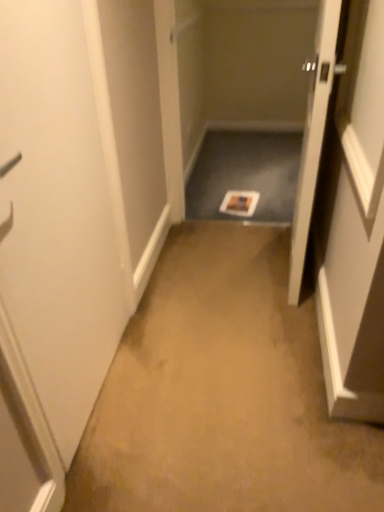
What is the approximate width of matte gray tray at center?

It is 5.29 feet.

This screenshot has height=512, width=384. What do you see at coordinates (57, 213) in the screenshot?
I see `white matte door at left, the first door in the left-to-right sequence` at bounding box center [57, 213].

Locate an element on the screen. The height and width of the screenshot is (512, 384). wooden door at right, the second door from the left is located at coordinates 313,138.

Considering the positions of point (3, 112) and point (249, 144), is point (3, 112) closer or farther from the camera than point (249, 144)?

Point (3, 112) is closer to the camera than point (249, 144).

Is white matte door at left, the second door positioned from the right, wider or thinner than matte gray tray at center?

Considering their sizes, white matte door at left, the second door positioned from the right, looks slimmer than matte gray tray at center.

Consider the image. Can you confirm if white matte door at left, the second door positioned from the right, is shorter than matte gray tray at center?

No.

Is wooden door at right, acting as the 1th door starting from the right, in contact with white matte door at left, the first door in the left-to-right sequence?

wooden door at right, acting as the 1th door starting from the right, is not next to white matte door at left, the first door in the left-to-right sequence, and they're not touching.

Where is `door on the right of white matte door at left, the second door positioned from the right`? The height and width of the screenshot is (512, 384). door on the right of white matte door at left, the second door positioned from the right is located at coordinates (313, 138).

Can you confirm if wooden door at right, acting as the 1th door starting from the right, is smaller than white matte door at left, the first door in the left-to-right sequence?

Incorrect, wooden door at right, acting as the 1th door starting from the right, is not smaller in size than white matte door at left, the first door in the left-to-right sequence.

Is wooden door at right, the second door from the left, located outside matte gray tray at center?

Yes, wooden door at right, the second door from the left, is not within matte gray tray at center.

From the image's perspective, which is above, wooden door at right, acting as the 1th door starting from the right, or matte gray tray at center?

From the image's view, matte gray tray at center is above.

Which of these two, wooden door at right, the second door from the left, or matte gray tray at center, is bigger?

wooden door at right, the second door from the left, is bigger.

Is point (272, 175) closer or farther from the camera than point (305, 143)?

Point (272, 175) is farther from the camera than point (305, 143).

Is matte gray tray at center surrounding wooden door at right, the second door from the left?

No.

Where is `corridor above the wooden door at right, the second door from the left (from the image's perspective)`? Image resolution: width=384 pixels, height=512 pixels. corridor above the wooden door at right, the second door from the left (from the image's perspective) is located at coordinates (245, 174).

At what (x,y) coordinates should I click in order to perform the action: click on the 2nd door in front of the matte gray tray at center, starting your count from the anchor. Please return your answer as a coordinate pair (x, y). The width and height of the screenshot is (384, 512). Looking at the image, I should click on (57, 213).

Is point (218, 190) positioned in front of point (32, 104)?

No.

From a real-world perspective, is white matte door at left, the first door in the left-to-right sequence, on wooden door at right, the second door from the left?

Indeed, from a real-world perspective, white matte door at left, the first door in the left-to-right sequence, stands above wooden door at right, the second door from the left.

Is white matte door at left, the second door positioned from the right, in front of or behind wooden door at right, acting as the 1th door starting from the right, in the image?

white matte door at left, the second door positioned from the right, is in front of wooden door at right, acting as the 1th door starting from the right.

Considering the relative sizes of white matte door at left, the second door positioned from the right, and wooden door at right, the second door from the left, in the image provided, is white matte door at left, the second door positioned from the right, smaller than wooden door at right, the second door from the left,?

Correct, white matte door at left, the second door positioned from the right, occupies less space than wooden door at right, the second door from the left.

Locate an element on the screen. This screenshot has height=512, width=384. the 2nd door directly above the matte gray tray at center (from a real-world perspective) is located at coordinates (57, 213).

Identify the location of door in front of the wooden door at right, the second door from the left. The width and height of the screenshot is (384, 512). (57, 213).

In the scene shown: Based on their spatial positions, is matte gray tray at center or wooden door at right, acting as the 1th door starting from the right, closer to white matte door at left, the first door in the left-to-right sequence?

wooden door at right, acting as the 1th door starting from the right, is closer to white matte door at left, the first door in the left-to-right sequence.

Based on their spatial positions, is wooden door at right, the second door from the left, or white matte door at left, the second door positioned from the right, further from matte gray tray at center?

white matte door at left, the second door positioned from the right, is further to matte gray tray at center.

In the scene shown: Considering their positions, is wooden door at right, the second door from the left, positioned further to white matte door at left, the first door in the left-to-right sequence, than matte gray tray at center?

The object further to white matte door at left, the first door in the left-to-right sequence, is matte gray tray at center.

Considering their positions, is white matte door at left, the second door positioned from the right, positioned closer to wooden door at right, the second door from the left, than matte gray tray at center?

white matte door at left, the second door positioned from the right, lies closer to wooden door at right, the second door from the left, than the other object.

When comparing their distances from wooden door at right, acting as the 1th door starting from the right, does matte gray tray at center or white matte door at left, the first door in the left-to-right sequence, seem further?

The object further to wooden door at right, acting as the 1th door starting from the right, is matte gray tray at center.

Estimate the real-world distances between objects in this image. Which object is closer to matte gray tray at center, white matte door at left, the first door in the left-to-right sequence, or wooden door at right, acting as the 1th door starting from the right?

The object closer to matte gray tray at center is wooden door at right, acting as the 1th door starting from the right.

You are a GUI agent. You are given a task and a screenshot of the screen. Output one action in this format:
    pyautogui.click(x=<x>, y=<y>)
    Task: Click on the door positioned between white matte door at left, the second door positioned from the right, and matte gray tray at center from near to far
    This screenshot has width=384, height=512.
    Given the screenshot: What is the action you would take?
    pyautogui.click(x=313, y=138)